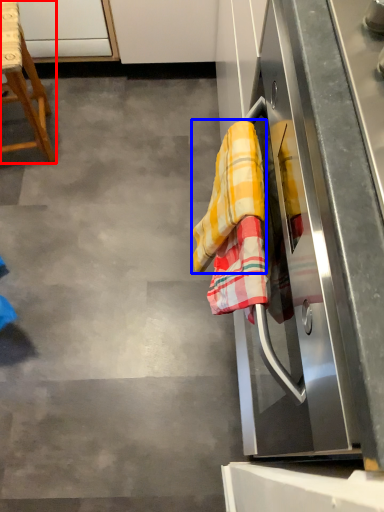
Question: Among these objects, which one is nearest to the camera, furniture (highlighted by a red box) or material (highlighted by a blue box)?

Choices:
 (A) furniture
 (B) material

Answer: (B)